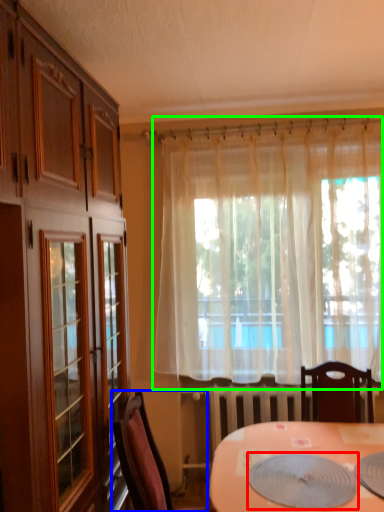
Question: Based on their relative distances, which object is farther from platter (highlighted by a red box)? Choose from chair (highlighted by a blue box) and curtain (highlighted by a green box).

Choices:
 (A) chair
 (B) curtain

Answer: (B)